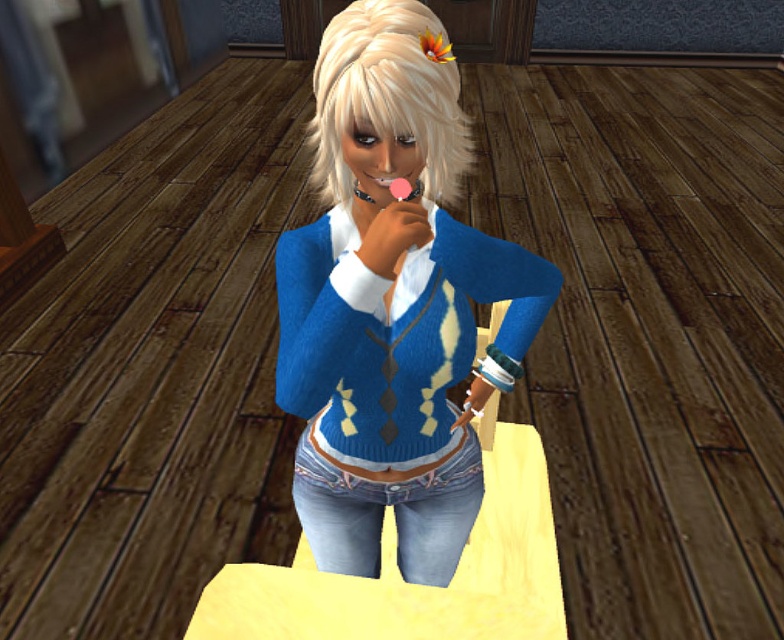
Question: Is blue knitted cardigan at center smaller than denim jeans at center?

Choices:
 (A) no
 (B) yes

Answer: (A)

Question: Does blue knitted cardigan at center have a greater width compared to matte black mouth at center?

Choices:
 (A) no
 (B) yes

Answer: (B)

Question: Which object is positioned farthest from the blue knitted sweater at center?

Choices:
 (A) blondehair at center
 (B) denim jeans at center
 (C) matte black mouth at center
 (D) blue knitted cardigan at center

Answer: (C)

Question: Which of the following is the farthest from the observer?

Choices:
 (A) denim jeans at center
 (B) matte black mouth at center
 (C) blondehair at center

Answer: (A)

Question: Which is farther from the matte black mouth at center?

Choices:
 (A) blue knitted sweater at center
 (B) blondehair at center

Answer: (A)

Question: Observing the image, what is the correct spatial positioning of blue knitted sweater at center in reference to blue knitted cardigan at center?

Choices:
 (A) above
 (B) below

Answer: (A)